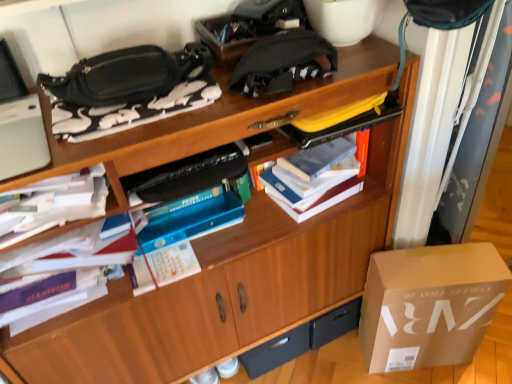
In order to face matte cardboard box at lower right, should I rotate leftwards or rightwards?

You should rotate right by 22.018 degrees.

What are the coordinates of `black matte bag at upper left, which appears as the second book when viewed from the right` in the screenshot? It's located at (130, 111).

The width and height of the screenshot is (512, 384). What do you see at coordinates (276, 351) in the screenshot?
I see `black matte drawer at lower center` at bounding box center [276, 351].

This screenshot has width=512, height=384. Identify the location of black matte drawer at lower center. (276, 351).

At what (x,y) coordinates should I click in order to perform the action: click on white paper at left, acting as the third book starting from the right. Please return your answer as a coordinate pair (x, y). This screenshot has height=384, width=512. Looking at the image, I should click on (60, 215).

Can you confirm if hardcover book at center, the 4th book from the left, is wider than black matte bag at upper left, positioned as the third book in left-to-right order?

No.

Would you say black matte bag at upper left, which appears as the second book when viewed from the right, is part of hardcover book at center, placed as the first book when sorted from right to left,'s contents?

No, hardcover book at center, placed as the first book when sorted from right to left, does not contain black matte bag at upper left, which appears as the second book when viewed from the right.

From the image's perspective, is hardcover book at center, the 4th book from the left, above or below black matte bag at upper left, which appears as the second book when viewed from the right?

Clearly, from the image's perspective, hardcover book at center, the 4th book from the left, is below black matte bag at upper left, which appears as the second book when viewed from the right.

Is hardcover book at center, placed as the first book when sorted from right to left, positioned with its back to black matte bag at upper left, positioned as the third book in left-to-right order?

No, hardcover book at center, placed as the first book when sorted from right to left, is not facing away from black matte bag at upper left, positioned as the third book in left-to-right order.

Would you say white paper stack at left, which ranks as the 1th book in left-to-right order, is to the left or to the right of white fabric curtain at upper right in the picture?

white paper stack at left, which ranks as the 1th book in left-to-right order, is positioned on white fabric curtain at upper right's left side.

Could you tell me if white paper stack at left, the fourth book in the right-to-left sequence, is turned towards white fabric curtain at upper right?

No.

Does white paper stack at left, the fourth book in the right-to-left sequence, have a smaller size compared to white fabric curtain at upper right?

Yes.

Does point (69, 297) appear closer or farther from the camera than point (433, 162)?

Point (69, 297) appears to be closer to the viewer than point (433, 162).

Is black leather handbag at upper left facing away from black matte bag at upper left, which appears as the second book when viewed from the right?

No, black leather handbag at upper left's orientation is not away from black matte bag at upper left, which appears as the second book when viewed from the right.

Can we say black leather handbag at upper left lies outside black matte bag at upper left, which appears as the second book when viewed from the right?

That's correct, black leather handbag at upper left is outside of black matte bag at upper left, which appears as the second book when viewed from the right.

At what (x,y) coordinates should I click in order to perform the action: click on handbag above the black matte bag at upper left, which appears as the second book when viewed from the right (from a real-world perspective). Please return your answer as a coordinate pair (x, y). This screenshot has height=384, width=512. Looking at the image, I should click on (128, 75).

Which is behind, point (480, 134) or point (283, 355)?

Point (283, 355)

Which of these two, white fabric curtain at upper right or black matte drawer at lower center, is thinner?

With smaller width is black matte drawer at lower center.

This screenshot has height=384, width=512. Identify the location of drawer located underneath the white fabric curtain at upper right (from a real-world perspective). (276, 351).

Looking at this image, can you confirm if black leather handbag at upper left is positioned to the left of white fabric curtain at upper right?

Correct, you'll find black leather handbag at upper left to the left of white fabric curtain at upper right.

Based on their sizes in the image, would you say black leather handbag at upper left is bigger or smaller than white fabric curtain at upper right?

black leather handbag at upper left is smaller than white fabric curtain at upper right.

Is black leather handbag at upper left oriented away from white fabric curtain at upper right?

No, white fabric curtain at upper right is not at the back of black leather handbag at upper left.

From a real-world perspective, which is physically above, black leather handbag at upper left or white fabric curtain at upper right?

In real-world perspective, black leather handbag at upper left is above.

Can you confirm if black fabric pouch at upper center is thinner than hardcover book at center, the 4th book from the left?

Yes, black fabric pouch at upper center is thinner than hardcover book at center, the 4th book from the left.

From the image's perspective, relative to hardcover book at center, placed as the first book when sorted from right to left, is black fabric pouch at upper center above or below?

black fabric pouch at upper center is situated higher than hardcover book at center, placed as the first book when sorted from right to left, in the image.

In the scene shown: Is black fabric pouch at upper center turned away from hardcover book at center, placed as the first book when sorted from right to left?

That's not correct — black fabric pouch at upper center is not looking away from hardcover book at center, placed as the first book when sorted from right to left.

Is the depth of black fabric pouch at upper center greater than that of hardcover book at center, the 4th book from the left?

No.

From a real-world perspective, is matte cardboard box at lower right on top of black matte drawer at lower center?

Correct, in the physical world, matte cardboard box at lower right is higher than black matte drawer at lower center.

Consider the image. Is the position of matte cardboard box at lower right less distant than that of black matte drawer at lower center?

Yes, matte cardboard box at lower right is closer to the viewer.

Choose the correct answer: Is matte cardboard box at lower right inside black matte drawer at lower center or outside it?

matte cardboard box at lower right is not inside black matte drawer at lower center, it's outside.

Where is `box located above the black matte drawer at lower center (from a real-world perspective)`? Image resolution: width=512 pixels, height=384 pixels. box located above the black matte drawer at lower center (from a real-world perspective) is located at coordinates (429, 305).

Identify the location of the 1st book counting from the left of the hardcover book at center, placed as the first book when sorted from right to left. Image resolution: width=512 pixels, height=384 pixels. (130, 111).

This screenshot has height=384, width=512. What are the coordinates of `the 3rd book behind when counting from the white fabric curtain at upper right` in the screenshot? It's located at (77, 287).

Which object lies nearer to the anchor point matte cardboard box at lower right, black leather handbag at upper left or white paper stack at left, the fourth book in the right-to-left sequence?

The object closer to matte cardboard box at lower right is white paper stack at left, the fourth book in the right-to-left sequence.

Considering their positions, is hardcover book at center, placed as the first book when sorted from right to left, positioned further to white fabric curtain at upper right than black matte drawer at lower center?

The object further to white fabric curtain at upper right is black matte drawer at lower center.

When comparing their distances from black fabric pouch at upper center, does white paper stack at left, the fourth book in the right-to-left sequence, or white paper at left, acting as the third book starting from the right, seem closer?

white paper at left, acting as the third book starting from the right, is positioned closer to the anchor black fabric pouch at upper center.

Based on their spatial positions, is matte cardboard box at lower right or hardcover book at center, the 4th book from the left, closer to white paper stack at left, the fourth book in the right-to-left sequence?

Based on the image, hardcover book at center, the 4th book from the left, appears to be nearer to white paper stack at left, the fourth book in the right-to-left sequence.

Considering their positions, is white fabric curtain at upper right positioned closer to black matte drawer at lower center than black fabric pouch at upper center?

Among the two, white fabric curtain at upper right is located nearer to black matte drawer at lower center.

Which object lies nearer to the anchor point black fabric pouch at upper center, matte cardboard box at lower right or white paper at left, which is the second book in left-to-right order?

white paper at left, which is the second book in left-to-right order.

Which object lies further to the anchor point black matte drawer at lower center, white paper stack at left, the fourth book in the right-to-left sequence, or hardcover book at center, placed as the first book when sorted from right to left?

white paper stack at left, the fourth book in the right-to-left sequence, is further to black matte drawer at lower center.

When comparing their distances from black leather handbag at upper left, does white paper at left, which is the second book in left-to-right order, or matte cardboard box at lower right seem further?

matte cardboard box at lower right is positioned further to the anchor black leather handbag at upper left.

At what (x,y) coordinates should I click in order to perform the action: click on curtain between black fabric pouch at upper center and matte cardboard box at lower right vertically. Please return your answer as a coordinate pair (x, y). Looking at the image, I should click on (452, 126).

Where is `book between black matte bag at upper left, positioned as the third book in left-to-right order, and white fabric curtain at upper right`? This screenshot has height=384, width=512. book between black matte bag at upper left, positioned as the third book in left-to-right order, and white fabric curtain at upper right is located at coordinates (319, 200).

The image size is (512, 384). What are the coordinates of `pouch that lies between black leather handbag at upper left and black matte drawer at lower center from top to bottom` in the screenshot? It's located at (282, 63).

The image size is (512, 384). What are the coordinates of `box that lies between hardcover book at center, placed as the first book when sorted from right to left, and black matte drawer at lower center from top to bottom` in the screenshot? It's located at (429, 305).